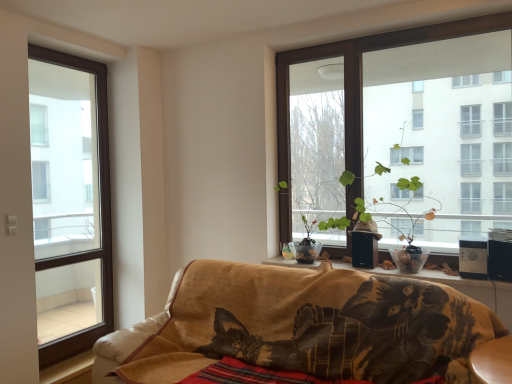
Find the location of a particular element. brown wooden window at upper right, acting as the 1th window starting from the right is located at coordinates (356, 88).

This screenshot has height=384, width=512. What do you see at coordinates (70, 202) in the screenshot? I see `brown wood window at left, the 2th window from the right` at bounding box center [70, 202].

What do you see at coordinates (362, 330) in the screenshot? This screenshot has height=384, width=512. I see `velvet-like brown cat at lower center` at bounding box center [362, 330].

Describe the element at coordinates (384, 217) in the screenshot. I see `green matte plant at center` at that location.

The image size is (512, 384). I want to click on brown wooden window at upper right, acting as the 1th window starting from the right, so click(356, 88).

Which is nearer, (411, 38) or (89, 287)?

Point (411, 38).

Can you confirm if brown wooden window at upper right, placed as the 2th window when sorted from left to right, is wider than brown wood window at left, the 2th window from the right?

Indeed, brown wooden window at upper right, placed as the 2th window when sorted from left to right, has a greater width compared to brown wood window at left, the 2th window from the right.

Considering the relative positions of brown wooden window at upper right, acting as the 1th window starting from the right, and brown wood window at left, the 2th window from the right, in the image provided, is brown wooden window at upper right, acting as the 1th window starting from the right, to the right of brown wood window at left, the 2th window from the right, from the viewer's perspective?

Indeed, brown wooden window at upper right, acting as the 1th window starting from the right, is positioned on the right side of brown wood window at left, the 2th window from the right.

How different are the orientations of brown wood window at left, which ranks as the 1th window in left-to-right order, and brown wooden window at upper right, placed as the 2th window when sorted from left to right, in degrees?

The angular difference between brown wood window at left, which ranks as the 1th window in left-to-right order, and brown wooden window at upper right, placed as the 2th window when sorted from left to right, is 88.7 degrees.

Based on the photo, which of these two, brown wood window at left, which ranks as the 1th window in left-to-right order, or brown wooden window at upper right, placed as the 2th window when sorted from left to right, is bigger?

With larger size is brown wooden window at upper right, placed as the 2th window when sorted from left to right.

From a real-world perspective, does brown wood window at left, the 2th window from the right, sit lower than brown wooden window at upper right, placed as the 2th window when sorted from left to right?

Yes, from a real-world perspective, brown wood window at left, the 2th window from the right, is under brown wooden window at upper right, placed as the 2th window when sorted from left to right.

Which object is wider, velvet-like brown cat at lower center or green matte plant at center?

Wider between the two is velvet-like brown cat at lower center.

Which is more distant, (389, 355) or (379, 199)?

The point (379, 199) is more distant.

From the image's perspective, which is below, velvet-like brown cat at lower center or green matte plant at center?

velvet-like brown cat at lower center appears lower in the image.

Does velvet-like brown cat at lower center have a lesser height compared to green matte plant at center?

Incorrect, the height of velvet-like brown cat at lower center does not fall short of that of green matte plant at center.

Is green matte plant at center taller or shorter than brown wood window at left, the 2th window from the right?

In the image, green matte plant at center appears to be shorter than brown wood window at left, the 2th window from the right.

Considering the relative sizes of green matte plant at center and brown wood window at left, which ranks as the 1th window in left-to-right order, in the image provided, is green matte plant at center thinner than brown wood window at left, which ranks as the 1th window in left-to-right order,?

Incorrect, the width of green matte plant at center is not less than that of brown wood window at left, which ranks as the 1th window in left-to-right order.

From a real-world perspective, is green matte plant at center located beneath brown wood window at left, which ranks as the 1th window in left-to-right order?

No, from a real-world perspective, green matte plant at center is not under brown wood window at left, which ranks as the 1th window in left-to-right order.

Is green matte plant at center oriented towards brown wood window at left, which ranks as the 1th window in left-to-right order?

No, green matte plant at center does not turn towards brown wood window at left, which ranks as the 1th window in left-to-right order.

Which is correct: green matte plant at center is inside velvet-like brown cat at lower center, or outside of it?

green matte plant at center is spatially situated outside velvet-like brown cat at lower center.

Looking at this image, does green matte plant at center lie in front of velvet-like brown cat at lower center?

No, green matte plant at center is behind velvet-like brown cat at lower center.

From the image's perspective, is green matte plant at center over velvet-like brown cat at lower center?

Indeed, from the image's perspective, green matte plant at center is shown above velvet-like brown cat at lower center.

In terms of height, does green matte plant at center look taller or shorter compared to velvet-like brown cat at lower center?

In the image, green matte plant at center appears to be shorter than velvet-like brown cat at lower center.

In the scene shown: Is velvet-like brown cat at lower center at the left side of brown wooden window at upper right, placed as the 2th window when sorted from left to right?

Yes, velvet-like brown cat at lower center is to the left of brown wooden window at upper right, placed as the 2th window when sorted from left to right.

Consider the image. From a real-world perspective, between velvet-like brown cat at lower center and brown wooden window at upper right, acting as the 1th window starting from the right, who is vertically lower?

In real-world perspective, velvet-like brown cat at lower center is lower.

Considering the relative sizes of velvet-like brown cat at lower center and brown wooden window at upper right, acting as the 1th window starting from the right, in the image provided, is velvet-like brown cat at lower center bigger than brown wooden window at upper right, acting as the 1th window starting from the right,?

Indeed, velvet-like brown cat at lower center has a larger size compared to brown wooden window at upper right, acting as the 1th window starting from the right.

From the image's perspective, does brown wood window at left, the 2th window from the right, appear lower than velvet-like brown cat at lower center?

No.

Does brown wood window at left, which ranks as the 1th window in left-to-right order, have a greater height compared to velvet-like brown cat at lower center?

Yes, brown wood window at left, which ranks as the 1th window in left-to-right order, is taller than velvet-like brown cat at lower center.

Is brown wood window at left, which ranks as the 1th window in left-to-right order, completely or partially outside of velvet-like brown cat at lower center?

Yes, brown wood window at left, which ranks as the 1th window in left-to-right order, is outside of velvet-like brown cat at lower center.

In order to click on window on the left of velvet-like brown cat at lower center in this screenshot , I will do `click(70, 202)`.

You are a GUI agent. You are given a task and a screenshot of the screen. Output one action in this format:
    pyautogui.click(x=<x>, y=<y>)
    Task: Click on the window above the brown wood window at left, the 2th window from the right (from a real-world perspective)
    The width and height of the screenshot is (512, 384).
    Given the screenshot: What is the action you would take?
    pyautogui.click(x=356, y=88)

Where is `window on the left of the brown wooden window at upper right, placed as the 2th window when sorted from left to right`? Image resolution: width=512 pixels, height=384 pixels. window on the left of the brown wooden window at upper right, placed as the 2th window when sorted from left to right is located at coordinates click(x=70, y=202).

Estimate the real-world distances between objects in this image. Which object is further from brown wooden window at upper right, placed as the 2th window when sorted from left to right, green matte plant at center or velvet-like brown cat at lower center?

Based on the image, velvet-like brown cat at lower center appears to be further to brown wooden window at upper right, placed as the 2th window when sorted from left to right.

Based on their spatial positions, is brown wood window at left, the 2th window from the right, or velvet-like brown cat at lower center further from brown wooden window at upper right, placed as the 2th window when sorted from left to right?

The object further to brown wooden window at upper right, placed as the 2th window when sorted from left to right, is brown wood window at left, the 2th window from the right.

Estimate the real-world distances between objects in this image. Which object is further from brown wood window at left, the 2th window from the right, velvet-like brown cat at lower center or brown wooden window at upper right, acting as the 1th window starting from the right?

Based on the image, velvet-like brown cat at lower center appears to be further to brown wood window at left, the 2th window from the right.

Which object lies further to the anchor point velvet-like brown cat at lower center, brown wooden window at upper right, placed as the 2th window when sorted from left to right, or brown wood window at left, the 2th window from the right?

The object further to velvet-like brown cat at lower center is brown wood window at left, the 2th window from the right.

Considering their positions, is velvet-like brown cat at lower center positioned closer to green matte plant at center than brown wood window at left, which ranks as the 1th window in left-to-right order?

Based on the image, velvet-like brown cat at lower center appears to be nearer to green matte plant at center.

Estimate the real-world distances between objects in this image. Which object is further from velvet-like brown cat at lower center, brown wood window at left, the 2th window from the right, or brown wooden window at upper right, acting as the 1th window starting from the right?

brown wood window at left, the 2th window from the right, is positioned further to the anchor velvet-like brown cat at lower center.

Which object lies nearer to the anchor point velvet-like brown cat at lower center, green matte plant at center or brown wooden window at upper right, placed as the 2th window when sorted from left to right?

Among the two, green matte plant at center is located nearer to velvet-like brown cat at lower center.

From the image, which object appears to be farther from brown wooden window at upper right, acting as the 1th window starting from the right, velvet-like brown cat at lower center or green matte plant at center?

velvet-like brown cat at lower center is further to brown wooden window at upper right, acting as the 1th window starting from the right.

At what (x,y) coordinates should I click in order to perform the action: click on cat between brown wood window at left, the 2th window from the right, and green matte plant at center. Please return your answer as a coordinate pair (x, y). The width and height of the screenshot is (512, 384). Looking at the image, I should click on (362, 330).

The width and height of the screenshot is (512, 384). What are the coordinates of `houseplant situated between brown wood window at left, which ranks as the 1th window in left-to-right order, and brown wooden window at upper right, acting as the 1th window starting from the right, from left to right` in the screenshot? It's located at (384, 217).

Locate an element on the screen. cat between brown wood window at left, the 2th window from the right, and brown wooden window at upper right, placed as the 2th window when sorted from left to right is located at coordinates (362, 330).

At what (x,y) coordinates should I click in order to perform the action: click on window between velvet-like brown cat at lower center and green matte plant at center along the z-axis. Please return your answer as a coordinate pair (x, y). The width and height of the screenshot is (512, 384). Looking at the image, I should click on (356, 88).